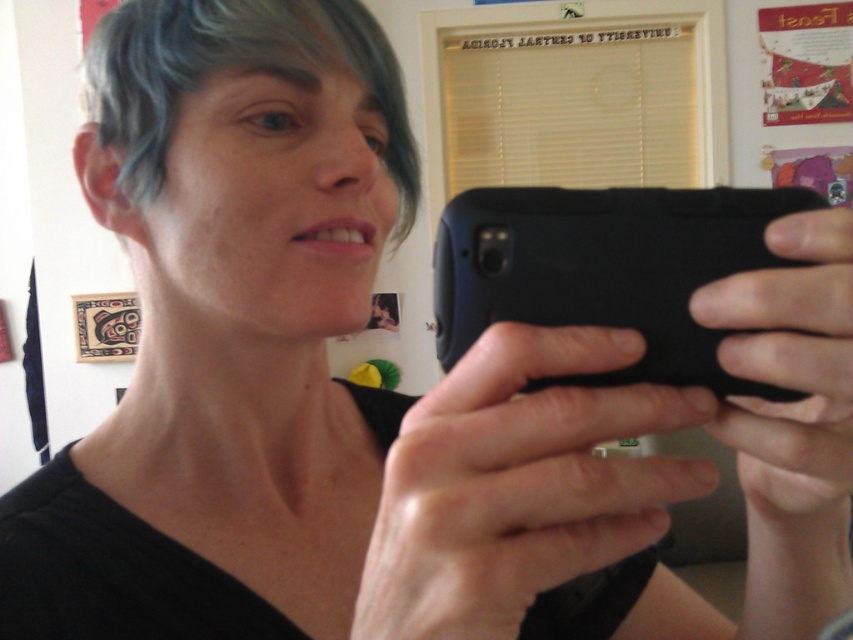
Is the position of black matte phone at center more distant than that of gray matte hair at upper left?

That is False.

Between black matte phone at center and gray matte hair at upper left, which one is positioned higher?

Positioned higher is gray matte hair at upper left.

What do you see at coordinates (606, 269) in the screenshot? I see `black matte phone at center` at bounding box center [606, 269].

Locate an element on the screen. Image resolution: width=853 pixels, height=640 pixels. black matte phone at center is located at coordinates (606, 269).